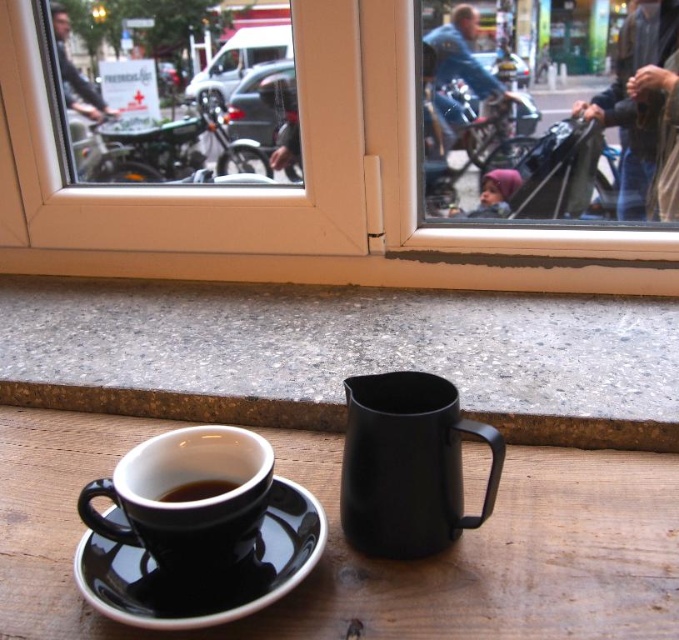
You are a delivery person who needs to hand over a package to the recipient. The recipient is sitting at the wooden table with the black glossy cup at lower left. You are outside the transparent glass window at center. Can you hand over the package without entering the building?

The transparent glass window at center is taller than black glossy cup at lower left, so you can hand over the package through the window since the window is tall enough to reach the recipient at the table.

You are standing in the room and want to determine which of the two points, point (x=3, y=232) or point (x=206, y=490), is closer to you. Based on the scene description, which point is closer?

Point (x=3, y=232) is closer to you because it is further to the viewer than point (x=206, y=490).